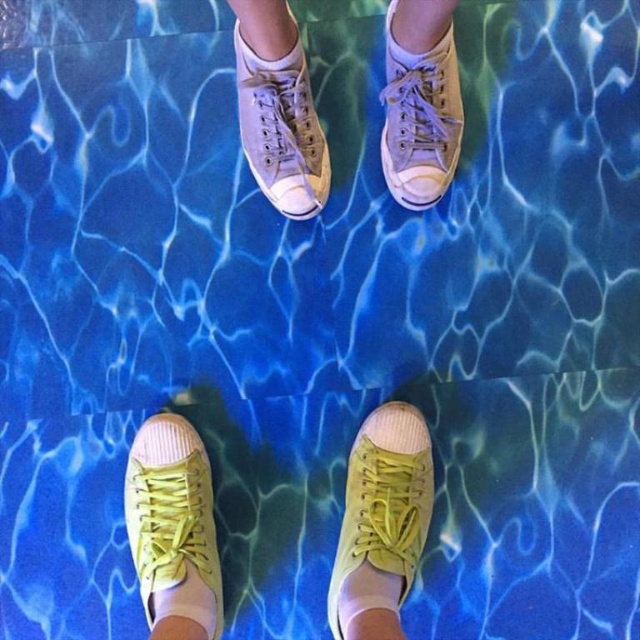
Question: Does yellow canvas shoes at lower center have a larger size compared to yellow canvas shoe at center?

Choices:
 (A) no
 (B) yes

Answer: (B)

Question: Which is farther from the light beige canvas shoes at center?

Choices:
 (A) light gray canvas shoe at upper center
 (B) matte canvas shoe at upper center
 (C) yellow canvas shoes at lower center
 (D) yellow canvas shoe at center

Answer: (C)

Question: Does matte yellow canvas shoe at lower left have a lesser width compared to matte canvas shoe at upper center?

Choices:
 (A) no
 (B) yes

Answer: (A)

Question: Among these objects, which one is nearest to the camera?

Choices:
 (A) white cotton sock at upper center
 (B) matte yellow canvas shoe at lower left
 (C) yellow canvas shoes at lower center
 (D) light gray canvas shoe at upper center

Answer: (A)

Question: Among these points, which one is farthest from the camera?

Choices:
 (A) (392, 147)
 (B) (284, 49)
 (C) (394, 522)
 (D) (369, 541)

Answer: (A)

Question: Does yellow canvas shoes at lower center appear on the right side of white cotton sock at upper center?

Choices:
 (A) no
 (B) yes

Answer: (A)